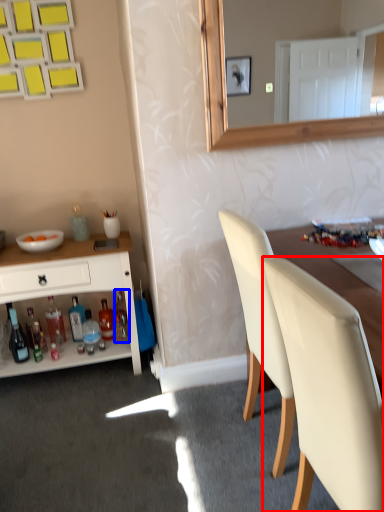
Question: Which object appears closest to the camera in this image, chair (highlighted by a red box) or bottle (highlighted by a blue box)?

Choices:
 (A) chair
 (B) bottle

Answer: (A)